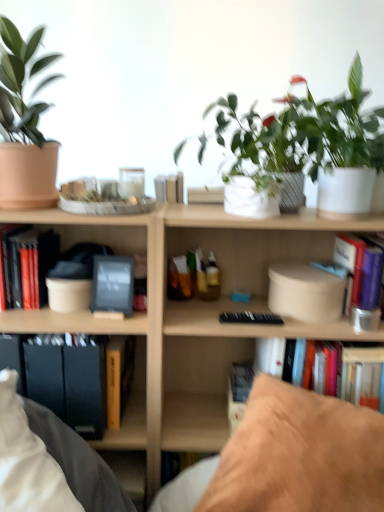
How much space does hardcover book at left, which ranks as the third paperback book in right-to-left order, occupy vertically?

hardcover book at left, which ranks as the third paperback book in right-to-left order, is 12.85 inches in height.

Locate an element on the screen. hardcover book at lower left, the second paperback book from the left is located at coordinates (86, 385).

In order to face matte terracotta pot at left, arranged as the first houseplant when viewed from the left, should I rotate leftwards or rightwards?

Rotate left and turn 21.014 degrees.

Measure the distance between point (x=6, y=180) and camera.

Point (x=6, y=180) is 3.54 feet away from camera.

Identify the location of brown suede pillow at lower right. The width and height of the screenshot is (384, 512). (299, 455).

Can you confirm if brown suede pillow at lower right is shorter than matte black folders at lower left?

Correct, brown suede pillow at lower right is not as tall as matte black folders at lower left.

The width and height of the screenshot is (384, 512). Identify the location of shelf in front of the brown suede pillow at lower right. (118, 333).

From a real-world perspective, who is located lower, brown suede pillow at lower right or matte black folders at lower left?

In real-world perspective, brown suede pillow at lower right is lower.

Measure the distance between brown suede pillow at lower right and matte black folders at lower left.

A distance of 17.11 inches exists between brown suede pillow at lower right and matte black folders at lower left.

Consider the image. Is hardcover book at left, the first book from the left, beside white matte flowerpot at center?

No, hardcover book at left, the first book from the left, is not with white matte flowerpot at center.

Can you confirm if hardcover book at left, the first book from the left, is thinner than white matte flowerpot at center?

Indeed, hardcover book at left, the first book from the left, has a lesser width compared to white matte flowerpot at center.

Can you tell me how much hardcover book at left, the second book viewed from the right, and white matte flowerpot at center differ in facing direction?

0.762 degrees.

Is hardcover book at left, the first book from the left, inside or outside of white matte flowerpot at center?

hardcover book at left, the first book from the left, exists outside the volume of white matte flowerpot at center.

Considering the sizes of objects hardcover book at center, which ranks as the 3th paperback book in left-to-right order, and hardcover book at lower left, the second paperback book from the left, in the image provided, who is smaller, hardcover book at center, which ranks as the 3th paperback book in left-to-right order, or hardcover book at lower left, the second paperback book from the left,?

hardcover book at center, which ranks as the 3th paperback book in left-to-right order.

Would you consider hardcover book at center, which ranks as the 3th paperback book in left-to-right order, to be distant from hardcover book at lower left, which ranks as the 2th paperback book in right-to-left order?

hardcover book at center, which ranks as the 3th paperback book in left-to-right order, is actually quite close to hardcover book at lower left, which ranks as the 2th paperback book in right-to-left order.

Is hardcover book at center, which ranks as the 3th paperback book in left-to-right order, looking in the opposite direction of hardcover book at lower left, the second paperback book from the left?

No, hardcover book at lower left, the second paperback book from the left, is not at the back of hardcover book at center, which ranks as the 3th paperback book in left-to-right order.

Is hardcover book at center, marked as the 1th paperback book in a right-to-left arrangement, shorter than hardcover book at lower left, which ranks as the 2th paperback book in right-to-left order?

Yes.

Is hardcover book at center, marked as the 1th paperback book in a right-to-left arrangement, positioned behind matte black folders at lower left?

That is True.

Considering the sizes of hardcover book at center, marked as the 1th paperback book in a right-to-left arrangement, and matte black folders at lower left in the image, is hardcover book at center, marked as the 1th paperback book in a right-to-left arrangement, taller or shorter than matte black folders at lower left?

hardcover book at center, marked as the 1th paperback book in a right-to-left arrangement, is shorter than matte black folders at lower left.

From a real-world perspective, is hardcover book at center, marked as the 1th paperback book in a right-to-left arrangement, under matte black folders at lower left?

Correct, in the physical world, hardcover book at center, marked as the 1th paperback book in a right-to-left arrangement, is lower than matte black folders at lower left.

Consider the image. From a real-world perspective, is wooden bookcase at center physically above hardcover book at center, which ranks as the 3th paperback book in left-to-right order?

Incorrect, from a real-world perspective, wooden bookcase at center is lower than hardcover book at center, which ranks as the 3th paperback book in left-to-right order.

Which of these two, wooden bookcase at center or hardcover book at center, marked as the 1th paperback book in a right-to-left arrangement, is thinner?

hardcover book at center, marked as the 1th paperback book in a right-to-left arrangement, is thinner.

Does point (140, 343) appear closer or farther from the camera than point (106, 391)?

Clearly, point (140, 343) is more distant from the camera than point (106, 391).

Is hardcover book at lower left, which ranks as the 2th paperback book in right-to-left order, inside or outside of wooden bookcase at center?

hardcover book at lower left, which ranks as the 2th paperback book in right-to-left order, can be found inside wooden bookcase at center.

Is hardcover book at lower left, the second paperback book from the left, bigger than wooden bookcase at center?

Incorrect, hardcover book at lower left, the second paperback book from the left, is not larger than wooden bookcase at center.

Is hardcover book at lower left, the second paperback book from the left, looking in the opposite direction of wooden bookcase at center?

Yes, hardcover book at lower left, the second paperback book from the left,'s orientation is away from wooden bookcase at center.

Which object is further away from the camera, hardcover book at lower left, the second paperback book from the left, or wooden bookcase at center?

hardcover book at lower left, the second paperback book from the left.

From a real-world perspective, between wooden bookcase at center and brown suede pillow at lower right, who is vertically higher?

wooden bookcase at center is physically above.

In the image, there is a wooden bookcase at center. Find the location of `pillow below it (from the image's perspective)`. pillow below it (from the image's perspective) is located at coordinates (299, 455).

Can you tell me how much wooden bookcase at center and brown suede pillow at lower right differ in facing direction?

The angle between the facing direction of wooden bookcase at center and the facing direction of brown suede pillow at lower right is 62 degrees.

Which point is more forward, (130,428) or (271,445)?

The point (271,445) is in front.

Image resolution: width=384 pixels, height=512 pixels. Find the location of `pillow below the matte black folders at lower left (from the image's perspective)`. pillow below the matte black folders at lower left (from the image's perspective) is located at coordinates (299, 455).

Locate an element on the screen. This screenshot has height=512, width=384. flowerpot above the hardcover book at left, the first book from the left (from a real-world perspective) is located at coordinates (249, 199).

When comparing their distances from hardcover book at left, positioned as the 1th paperback book in left-to-right order, does hardcover book at center, marked as the 1th paperback book in a right-to-left arrangement, or brown suede pillow at lower right seem further?

brown suede pillow at lower right is further to hardcover book at left, positioned as the 1th paperback book in left-to-right order.

Considering their positions, is brown suede pillow at lower right positioned closer to hardcover book at left, which ranks as the third paperback book in right-to-left order, than hardcover book at center, which ranks as the 3th paperback book in left-to-right order?

Among the two, hardcover book at center, which ranks as the 3th paperback book in left-to-right order, is located nearer to hardcover book at left, which ranks as the third paperback book in right-to-left order.

Considering their positions, is wooden bookcase at center positioned closer to hardcover book at left, the second book viewed from the right, than hardcover book at lower left, the second paperback book from the left?

Based on the image, hardcover book at lower left, the second paperback book from the left, appears to be nearer to hardcover book at left, the second book viewed from the right.

Estimate the real-world distances between objects in this image. Which object is closer to matte terracotta pot at left, arranged as the first houseplant when viewed from the left, purple matte book at upper right, which is the second book from left to right, or wooden bookcase at center?

wooden bookcase at center.

Looking at the image, which one is located closer to wooden bookcase at center, hardcover book at lower left, which ranks as the 2th paperback book in right-to-left order, or matte terracotta pot at left, arranged as the first houseplant when viewed from the left?

Among the two, hardcover book at lower left, which ranks as the 2th paperback book in right-to-left order, is located nearer to wooden bookcase at center.

From the image, which object appears to be farther from wooden bookcase at center, hardcover book at left, which ranks as the third paperback book in right-to-left order, or hardcover book at lower left, the second paperback book from the left?

hardcover book at left, which ranks as the third paperback book in right-to-left order, is further to wooden bookcase at center.

Based on their spatial positions, is matte black folders at lower left or hardcover book at left, positioned as the 1th paperback book in left-to-right order, closer to brown suede pillow at lower right?

matte black folders at lower left is closer to brown suede pillow at lower right.

Based on their spatial positions, is brown suede pillow at lower right or hardcover book at center, marked as the 1th paperback book in a right-to-left arrangement, further from matte terracotta pot at left, arranged as the first houseplant when viewed from the left?

Among the two, brown suede pillow at lower right is located further to matte terracotta pot at left, arranged as the first houseplant when viewed from the left.

The width and height of the screenshot is (384, 512). Identify the location of shelf between hardcover book at left, the first book from the left, and green matte plant at upper right, arranged as the first houseplant when viewed from the right, from left to right. (118, 333).

Identify the location of flowerpot between matte terracotta pot at left, arranged as the first houseplant when viewed from the left, and hardcover book at lower left, the second paperback book from the left, from top to bottom. This screenshot has width=384, height=512. (249, 199).

Locate an element on the screen. The height and width of the screenshot is (512, 384). pillow between hardcover book at left, the second book viewed from the right, and purple matte book at upper right, the first book positioned from the right is located at coordinates (299, 455).

Where is `flowerpot between hardcover book at left, which ranks as the third paperback book in right-to-left order, and green matte plant at upper right, the 2th houseplant when ordered from left to right`? The width and height of the screenshot is (384, 512). flowerpot between hardcover book at left, which ranks as the third paperback book in right-to-left order, and green matte plant at upper right, the 2th houseplant when ordered from left to right is located at coordinates (249, 199).